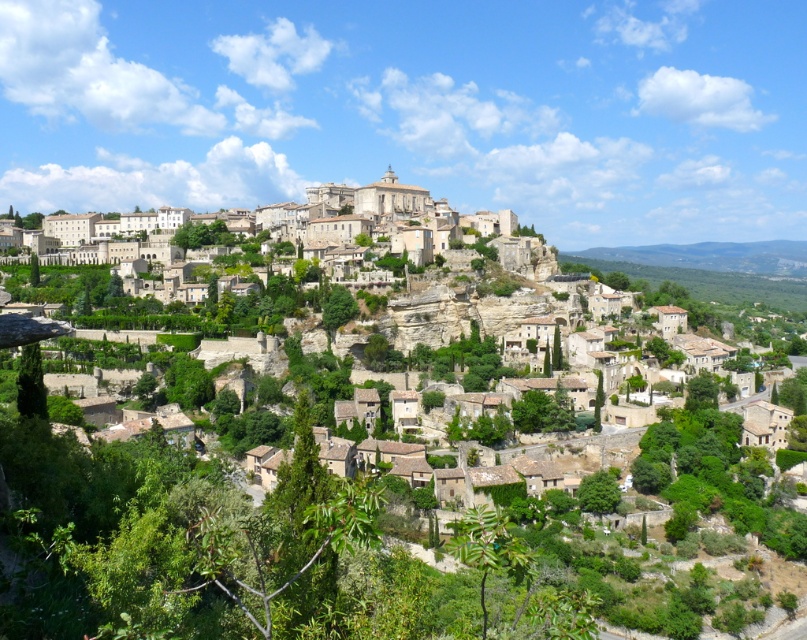
Question: Which point is closer to the camera?

Choices:
 (A) brown stone buildings at center
 (B) beige stone buildings at upper center

Answer: (A)

Question: Observing the image, what is the correct spatial positioning of beige stone buildings at upper center in reference to brown stone buildings at center?

Choices:
 (A) left
 (B) right

Answer: (A)

Question: Is beige stone buildings at upper center smaller than brown stone buildings at center?

Choices:
 (A) yes
 (B) no

Answer: (A)

Question: Which object is closer to the camera taking this photo?

Choices:
 (A) brown stone buildings at center
 (B) beige stone buildings at upper center

Answer: (A)

Question: Is beige stone buildings at upper center to the right of brown stone buildings at center from the viewer's perspective?

Choices:
 (A) yes
 (B) no

Answer: (B)